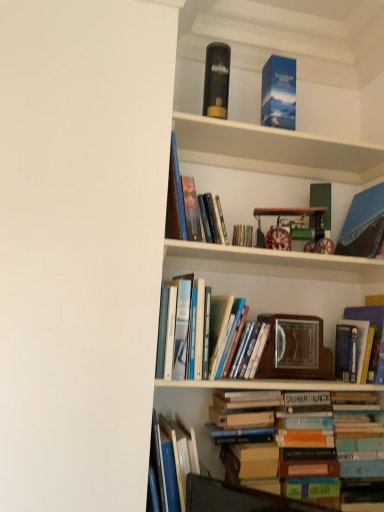
Identify the location of hardcover book at center, the 5th book in the bottom-to-top sequence. (242, 234).

How much space does hardcover book at center, which is counted as the fourth book, starting from the top, occupy vertically?

hardcover book at center, which is counted as the fourth book, starting from the top, is 3.80 inches in height.

What do you see at coordinates (274, 150) in the screenshot?
I see `blue cardboard box at upper center` at bounding box center [274, 150].

What is the approximate width of blue cardboard box at upper center?

It is 8.62 inches.

The height and width of the screenshot is (512, 384). What do you see at coordinates (205, 332) in the screenshot? I see `hardcover books at center, placed as the fifth book when sorted from top to bottom` at bounding box center [205, 332].

Find the location of a particular element. The height and width of the screenshot is (512, 384). blue canvas painting at upper right, placed as the sixth book when sorted from bottom to top is located at coordinates (363, 224).

What do you see at coordinates (373, 334) in the screenshot?
I see `hardcover book at center, which appears as the third book when ordered from the bottom` at bounding box center [373, 334].

Locate an element on the screen. hardcover book at center, which is counted as the fourth book, starting from the top is located at coordinates point(242,234).

From the image's perspective, would you say hardcover books at center, which is counted as the 2th book, starting from the bottom, is shown under blue matte book at upper center, positioned as the eighth book in bottom-to-top order?

Indeed, from the image's perspective, hardcover books at center, which is counted as the 2th book, starting from the bottom, is shown beneath blue matte book at upper center, positioned as the eighth book in bottom-to-top order.

Is hardcover books at center, which is counted as the 2th book, starting from the bottom, placed right next to blue matte book at upper center, the first book from the top?

There is a gap between hardcover books at center, which is counted as the 2th book, starting from the bottom, and blue matte book at upper center, the first book from the top.

Which of these two, hardcover books at center, the 7th book from the top, or blue matte book at upper center, positioned as the eighth book in bottom-to-top order, is thinner?

blue matte book at upper center, positioned as the eighth book in bottom-to-top order.

How distant is hardcover books at center, which is counted as the 2th book, starting from the bottom, from hardcover books at center, placed as the fifth book when sorted from top to bottom?

hardcover books at center, which is counted as the 2th book, starting from the bottom, is 13.82 inches from hardcover books at center, placed as the fifth book when sorted from top to bottom.

From the image's perspective, is hardcover books at center, the 7th book from the top, on top of hardcover books at center, placed as the fifth book when sorted from top to bottom?

Actually, hardcover books at center, the 7th book from the top, appears below hardcover books at center, placed as the fifth book when sorted from top to bottom, in the image.

Is hardcover books at center, the 7th book from the top, oriented away from hardcover books at center, marked as the fourth book in a bottom-to-top arrangement?

No.

What's the angular difference between hardcover books at center, which is counted as the 2th book, starting from the bottom, and hardcover books at center, marked as the fourth book in a bottom-to-top arrangement,'s facing directions?

They differ by 3.23 degrees in their facing directions.

Considering the relative sizes of hardcover book at lower center, acting as the 8th book starting from the top, and black matte book at upper center in the image provided, is hardcover book at lower center, acting as the 8th book starting from the top, taller than black matte book at upper center?

Correct, hardcover book at lower center, acting as the 8th book starting from the top, is much taller as black matte book at upper center.

How much distance is there between hardcover book at lower center, acting as the 8th book starting from the top, and black matte book at upper center?

The distance of hardcover book at lower center, acting as the 8th book starting from the top, from black matte book at upper center is 4.21 feet.

Is black matte book at upper center inside hardcover book at lower center, acting as the 8th book starting from the top?

No.

From a real-world perspective, is black matte book at upper center positioned under wooden picture frame at center based on gravity?

Incorrect, from a real-world perspective, black matte book at upper center is higher than wooden picture frame at center.

Does black matte book at upper center have a greater height compared to wooden picture frame at center?

Yes, black matte book at upper center is taller than wooden picture frame at center.

In the image, is black matte book at upper center on the left side or the right side of wooden picture frame at center?

black matte book at upper center is to the left of wooden picture frame at center.

What's the angular difference between black matte book at upper center and hardcover books at center, the 7th book from the top,'s facing directions?

2.16 degrees.

Is the position of black matte book at upper center less distant than that of hardcover books at center, the 7th book from the top?

No.

From a real-world perspective, is black matte book at upper center positioned above or below hardcover books at center, the 7th book from the top?

black matte book at upper center is situated higher than hardcover books at center, the 7th book from the top, in the real world.

Is black matte book at upper center aimed at hardcover books at center, the 7th book from the top?

No, black matte book at upper center is not aimed at hardcover books at center, the 7th book from the top.

Considering the sizes of blue matte book at upper center, positioned as the eighth book in bottom-to-top order, and hardcover books at center, marked as the fourth book in a bottom-to-top arrangement, in the image, is blue matte book at upper center, positioned as the eighth book in bottom-to-top order, wider or thinner than hardcover books at center, marked as the fourth book in a bottom-to-top arrangement,?

In the image, blue matte book at upper center, positioned as the eighth book in bottom-to-top order, appears to be more narrow than hardcover books at center, marked as the fourth book in a bottom-to-top arrangement.

How far apart are blue matte book at upper center, the first book from the top, and hardcover books at center, marked as the fourth book in a bottom-to-top arrangement?

blue matte book at upper center, the first book from the top, and hardcover books at center, marked as the fourth book in a bottom-to-top arrangement, are 32.26 inches apart.

Would you consider blue matte book at upper center, positioned as the eighth book in bottom-to-top order, to be distant from hardcover books at center, placed as the fifth book when sorted from top to bottom?

No, blue matte book at upper center, positioned as the eighth book in bottom-to-top order, is in close proximity to hardcover books at center, placed as the fifth book when sorted from top to bottom.

From the picture: From the image's perspective, which is below, blue matte book at upper center, the first book from the top, or hardcover books at center, marked as the fourth book in a bottom-to-top arrangement?

hardcover books at center, marked as the fourth book in a bottom-to-top arrangement, appears lower in the image.

Who is shorter, hardcover book at center, the 5th book in the bottom-to-top sequence, or blue canvas painting at upper right, the third book positioned from the top?

With less height is hardcover book at center, the 5th book in the bottom-to-top sequence.

Based on their sizes in the image, would you say hardcover book at center, which is counted as the fourth book, starting from the top, is bigger or smaller than blue canvas painting at upper right, the third book positioned from the top?

hardcover book at center, which is counted as the fourth book, starting from the top, is smaller than blue canvas painting at upper right, the third book positioned from the top.

Are hardcover book at center, which is counted as the fourth book, starting from the top, and blue canvas painting at upper right, the third book positioned from the top, beside each other?

No, hardcover book at center, which is counted as the fourth book, starting from the top, is not in contact with blue canvas painting at upper right, the third book positioned from the top.

Identify the location of the 5th book in front of the blue matte book at upper center, the first book from the top, counting from the anchor's position. The image size is (384, 512). (315, 453).

Starting from the hardcover books at center, the 7th book from the top, which book is the 4th one to the left? Please provide its 2D coordinates.

[(205, 332)]

Based on the photo, when comparing their distances from hardcover book at lower center, the first book positioned from the bottom, does blue cardboard box at upper center or blue matte book at upper center, the first book from the top, seem further?

blue matte book at upper center, the first book from the top.

Looking at the image, which one is located closer to black matte book at upper center, blue cardboard box at upper center or hardcover book at lower center, acting as the 8th book starting from the top?

blue cardboard box at upper center lies closer to black matte book at upper center than the other object.

Considering their positions, is hardcover book at center, the 5th book in the bottom-to-top sequence, positioned further to blue matte book at upper center, the first book from the top, than hardcover book at center, positioned as the sixth book in top-to-bottom order?

hardcover book at center, positioned as the sixth book in top-to-bottom order, is positioned further to the anchor blue matte book at upper center, the first book from the top.

Estimate the real-world distances between objects in this image. Which object is further from wooden picture frame at center, blue cardboard box at upper center or hardcover book at lower center, acting as the 8th book starting from the top?

blue cardboard box at upper center lies further to wooden picture frame at center than the other object.

From the image, which object appears to be nearer to blue canvas painting at upper right, the third book positioned from the top, hardcover books at center, which is counted as the 2th book, starting from the bottom, or wooden picture frame at center?

Among the two, wooden picture frame at center is located nearer to blue canvas painting at upper right, the third book positioned from the top.

Considering their positions, is blue matte book at upper center, positioned as the eighth book in bottom-to-top order, positioned further to hardcover books at center, marked as the fourth book in a bottom-to-top arrangement, than black matte book at upper center?

The object further to hardcover books at center, marked as the fourth book in a bottom-to-top arrangement, is black matte book at upper center.

From the image, which object appears to be farther from hardcover book at center, which appears as the third book when ordered from the bottom, hardcover books at center, marked as the fourth book in a bottom-to-top arrangement, or hardcover book at lower center, the first book positioned from the bottom?

The object further to hardcover book at center, which appears as the third book when ordered from the bottom, is hardcover book at lower center, the first book positioned from the bottom.

Considering their positions, is blue cardboard box at upper center positioned further to hardcover books at center, marked as the fourth book in a bottom-to-top arrangement, than wooden picture frame at center?

Based on the image, blue cardboard box at upper center appears to be further to hardcover books at center, marked as the fourth book in a bottom-to-top arrangement.

Identify the location of picture frame between hardcover book at lower center, the first book positioned from the bottom, and hardcover books at center, the 7th book from the top. (295, 349).

The height and width of the screenshot is (512, 384). Find the location of `picture frame between black matte book at upper center and hardcover book at lower center, the first book positioned from the bottom, vertically`. picture frame between black matte book at upper center and hardcover book at lower center, the first book positioned from the bottom, vertically is located at coordinates (295, 349).

Locate an element on the screen. The image size is (384, 512). picture frame between hardcover book at center, positioned as the sixth book in top-to-bottom order, and hardcover books at center, the 7th book from the top, in the vertical direction is located at coordinates (295, 349).

The image size is (384, 512). Find the location of `shelf between blue matte book at upper center, the first book from the top, and hardcover book at lower center, the first book positioned from the bottom, vertically`. shelf between blue matte book at upper center, the first book from the top, and hardcover book at lower center, the first book positioned from the bottom, vertically is located at coordinates [274, 150].